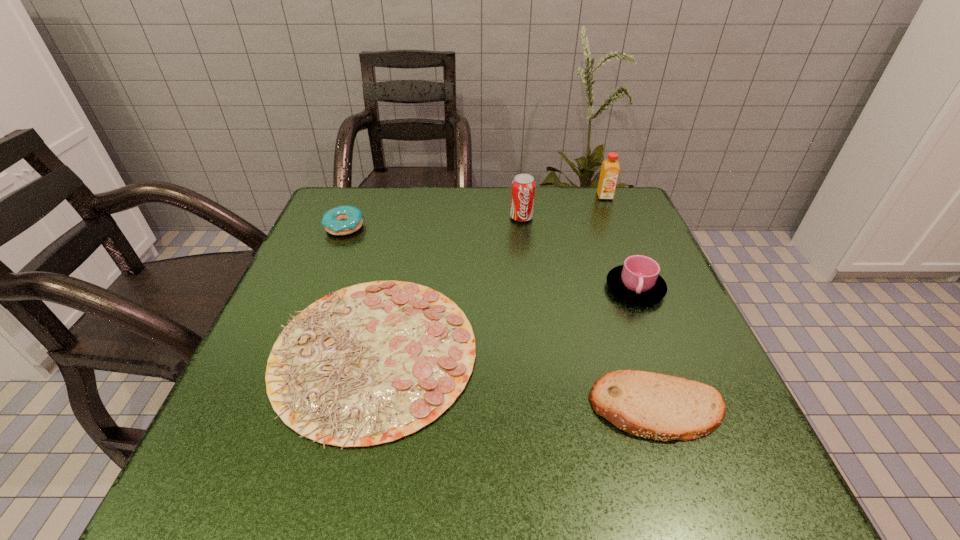
Image resolution: width=960 pixels, height=540 pixels. I want to click on vacant position located on the right of the doughnut, so click(408, 227).

Where is `free space located 0.140m on the left of the pita bread`? The width and height of the screenshot is (960, 540). free space located 0.140m on the left of the pita bread is located at coordinates (502, 408).

Image resolution: width=960 pixels, height=540 pixels. Identify the location of orange juice located in the far edge section of the desktop. (610, 168).

The image size is (960, 540). What are the coordinates of `soda can that is at the far edge` in the screenshot? It's located at (523, 186).

In order to click on doughnut located at the far edge in this screenshot , I will do `click(343, 220)`.

Identify the location of pizza present at the near edge. The height and width of the screenshot is (540, 960). click(368, 364).

Locate an element on the screen. pita bread located in the near edge section of the desktop is located at coordinates (656, 406).

Locate an element on the screen. pizza that is at the left edge is located at coordinates (368, 364).

Find the location of a particular element. doughnut positioned at the left edge is located at coordinates [343, 220].

Locate an element on the screen. This screenshot has height=540, width=960. orange juice that is at the right edge is located at coordinates (610, 168).